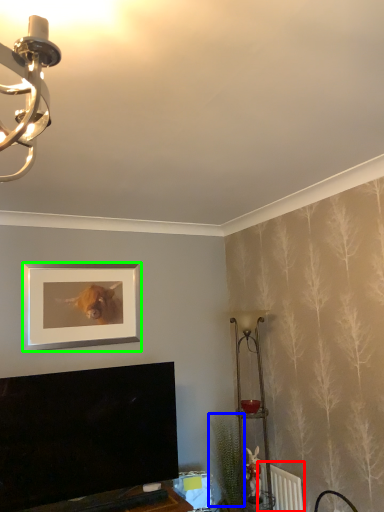
Question: Based on their relative distances, which object is farther from radiator (highlighted by a red box)? Choose from plant (highlighted by a blue box) and picture frame (highlighted by a green box).

Choices:
 (A) plant
 (B) picture frame

Answer: (B)